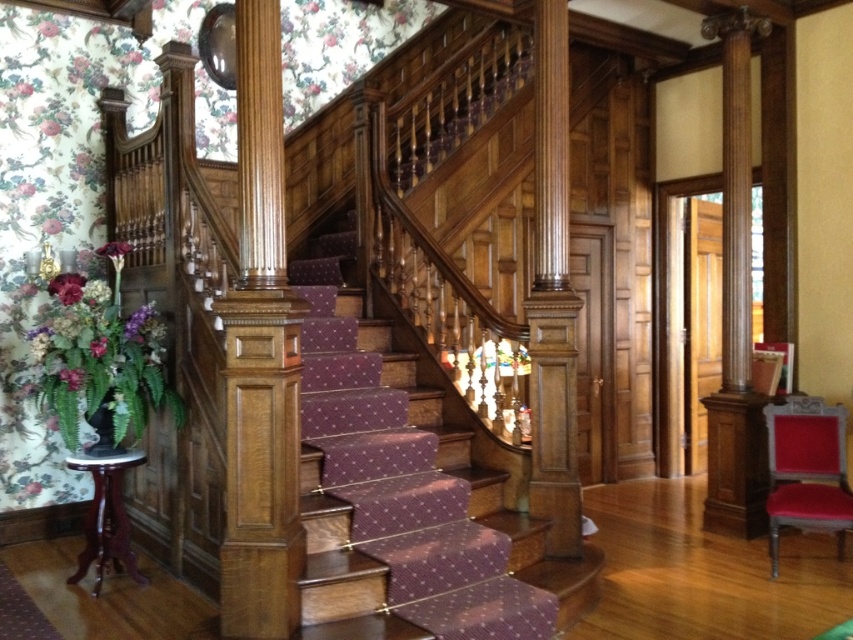
Question: Among these objects, which one is nearest to the camera?

Choices:
 (A) polished oak pillar at center
 (B) purple carpeted stairs at center
 (C) mahogany wood stool at lower left
 (D) brown polished wood column at right

Answer: (A)

Question: Is polished oak pillar at center to the left of polished wood pillar at center from the viewer's perspective?

Choices:
 (A) yes
 (B) no

Answer: (A)

Question: Can you confirm if purple carpeted stairs at center is bigger than brown polished wood column at right?

Choices:
 (A) no
 (B) yes

Answer: (B)

Question: Which point is closer to the camera taking this photo?

Choices:
 (A) (112, 483)
 (B) (410, 515)
 (C) (740, 269)

Answer: (B)

Question: Based on their relative distances, which object is nearer to the polished oak pillar at center?

Choices:
 (A) velvet red armchair at lower right
 (B) brown polished wood column at right

Answer: (A)

Question: Does purple carpeted stairs at center come in front of brown polished wood column at right?

Choices:
 (A) yes
 (B) no

Answer: (A)